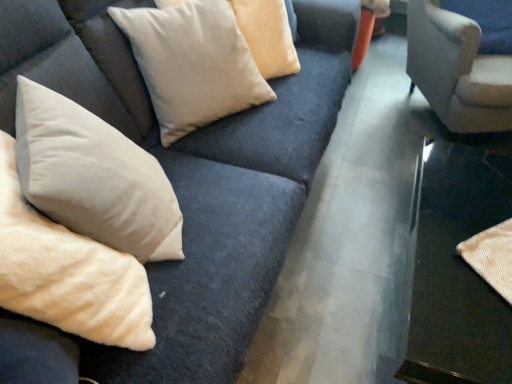
Where is `vacant point above metallic silver table at lower right (from a real-world perspective)`? The height and width of the screenshot is (384, 512). vacant point above metallic silver table at lower right (from a real-world perspective) is located at coordinates (x=460, y=253).